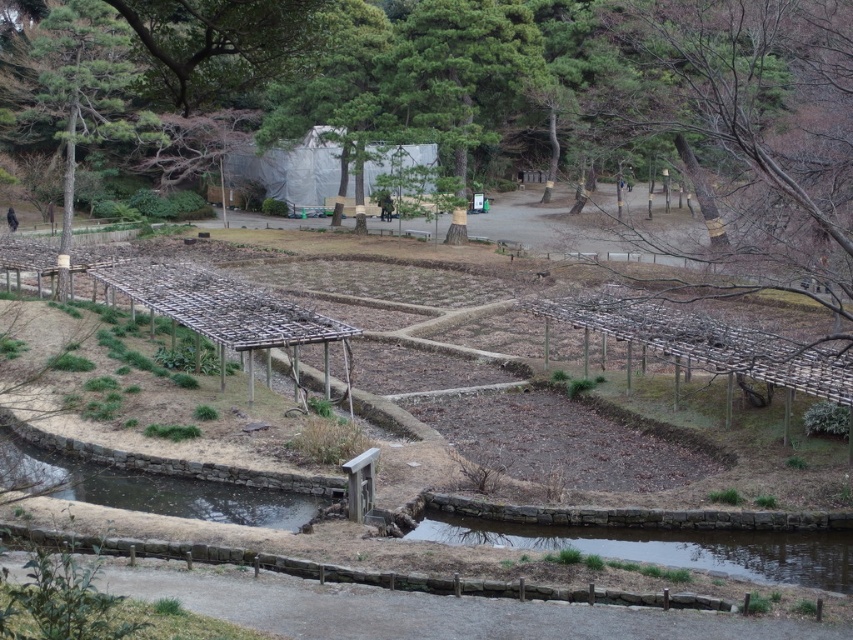
Question: Can you confirm if brown wooden trellis at center is smaller than green textured tree at upper left?

Choices:
 (A) no
 (B) yes

Answer: (A)

Question: Among these points, which one is nearest to the camera?

Choices:
 (A) (80, 108)
 (B) (786, 548)
 (C) (825, 154)

Answer: (B)

Question: Which of the following is the farthest from the observer?

Choices:
 (A) clear water at bottom center
 (B) green textured tree at upper left

Answer: (B)

Question: Does clear water at bottom center have a larger size compared to green textured tree at upper left?

Choices:
 (A) no
 (B) yes

Answer: (A)

Question: Which is nearer to the green textured tree at upper left?

Choices:
 (A) clear water at bottom center
 (B) clear water at bottom left
 (C) brown wooden trellis at center

Answer: (C)

Question: Is brown wooden trellis at center closer to the viewer compared to clear water at bottom left?

Choices:
 (A) no
 (B) yes

Answer: (B)